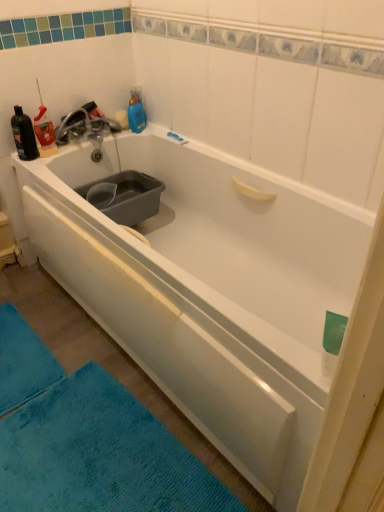
Question: Is blue soft bath mat at lower left facing towards matte silver faucet at upper left?

Choices:
 (A) no
 (B) yes

Answer: (A)

Question: Can you confirm if blue soft bath mat at lower left is positioned to the right of matte silver faucet at upper left?

Choices:
 (A) yes
 (B) no

Answer: (B)

Question: Is matte silver faucet at upper left surrounded by blue soft bath mat at lower left?

Choices:
 (A) yes
 (B) no

Answer: (B)

Question: Can you confirm if blue soft bath mat at lower left is thinner than matte silver faucet at upper left?

Choices:
 (A) no
 (B) yes

Answer: (A)

Question: Does blue soft bath mat at lower left come behind matte silver faucet at upper left?

Choices:
 (A) no
 (B) yes

Answer: (A)

Question: Is point (56, 137) closer or farther from the camera than point (43, 370)?

Choices:
 (A) closer
 (B) farther

Answer: (B)

Question: Considering the positions of matte silver faucet at upper left and blue soft bath mat at lower left in the image, is matte silver faucet at upper left taller or shorter than blue soft bath mat at lower left?

Choices:
 (A) tall
 (B) short

Answer: (A)

Question: From a real-world perspective, is matte silver faucet at upper left positioned above or below blue soft bath mat at lower left?

Choices:
 (A) below
 (B) above

Answer: (B)

Question: Looking at their shapes, would you say matte silver faucet at upper left is wider or thinner than blue soft bath mat at lower left?

Choices:
 (A) thin
 (B) wide

Answer: (A)

Question: Is matte silver faucet at upper left inside or outside of black matte bottle at upper left?

Choices:
 (A) outside
 (B) inside

Answer: (A)

Question: In terms of width, does matte silver faucet at upper left look wider or thinner when compared to black matte bottle at upper left?

Choices:
 (A) thin
 (B) wide

Answer: (B)

Question: From a real-world perspective, is matte silver faucet at upper left positioned above or below black matte bottle at upper left?

Choices:
 (A) above
 (B) below

Answer: (B)

Question: In the image, is matte silver faucet at upper left on the left side or the right side of black matte bottle at upper left?

Choices:
 (A) left
 (B) right

Answer: (B)

Question: Visually, is blue soft bath mat at lower left positioned to the left or to the right of black matte bottle at upper left?

Choices:
 (A) left
 (B) right

Answer: (A)

Question: From the image's perspective, is blue soft bath mat at lower left above or below black matte bottle at upper left?

Choices:
 (A) above
 (B) below

Answer: (B)